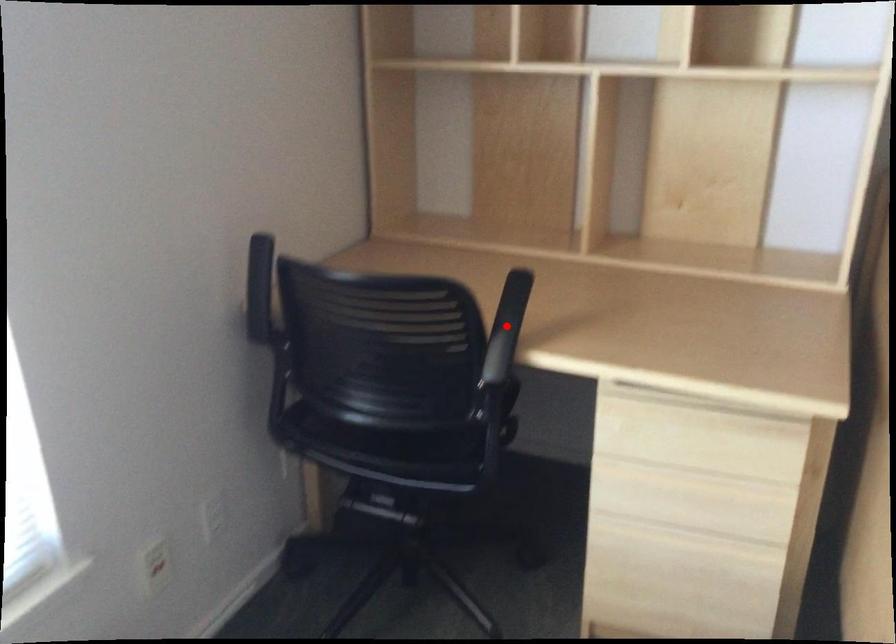
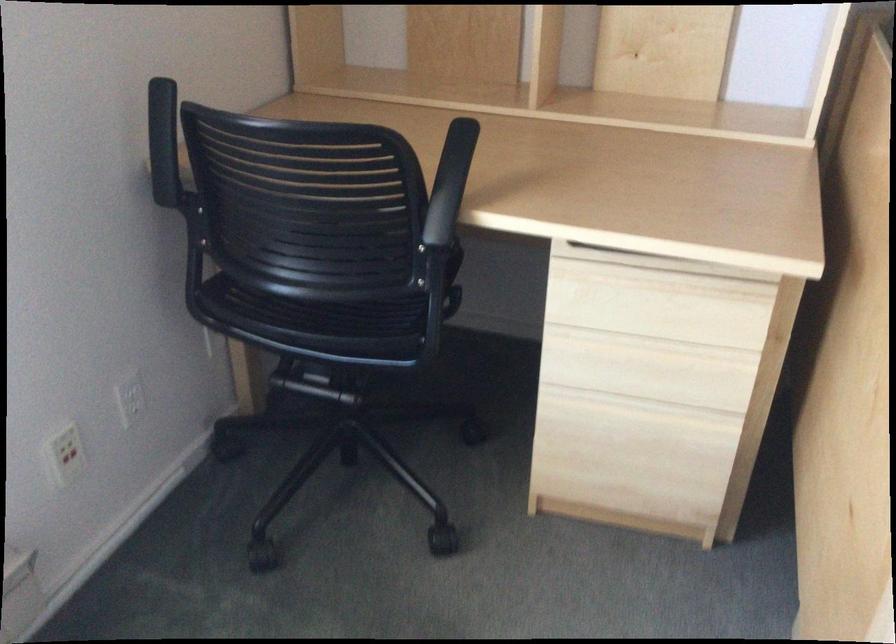
Find the pixel in the second image that matches the highlighted location in the first image.

(450, 183)